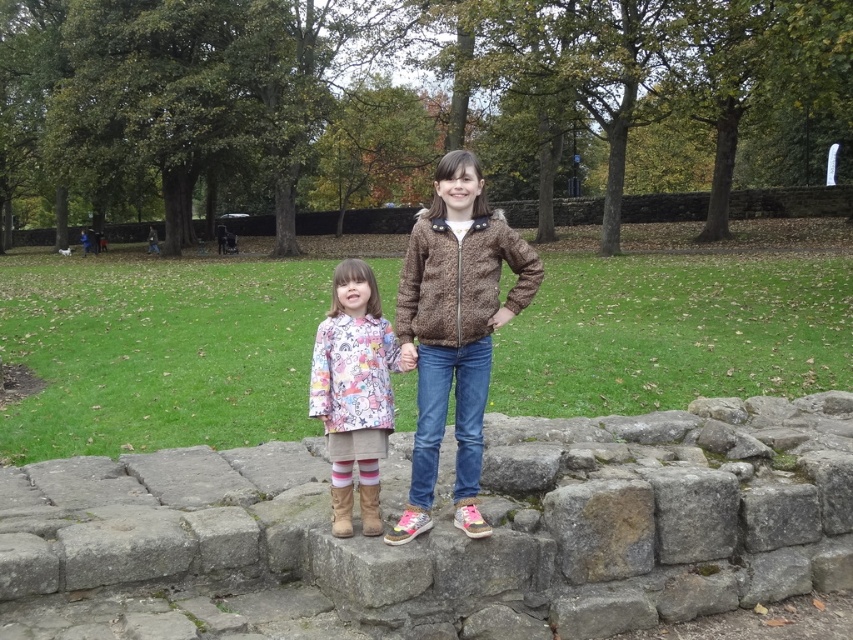
Question: Which object appears closest to the camera in this image?

Choices:
 (A) printed fabric coat at center
 (B) brown stone at center

Answer: (B)

Question: Which object is positioned farthest from the brown textured jacket at center?

Choices:
 (A) brown stone at center
 (B) printed fabric coat at center

Answer: (A)

Question: Which is nearer to the brown textured jacket at center?

Choices:
 (A) brown stone at center
 (B) printed fabric coat at center

Answer: (B)

Question: Is brown stone at center to the left of brown textured jacket at center from the viewer's perspective?

Choices:
 (A) yes
 (B) no

Answer: (A)

Question: In this image, where is brown stone at center located relative to brown textured jacket at center?

Choices:
 (A) above
 (B) below

Answer: (B)

Question: Where is brown stone at center located in relation to brown textured jacket at center in the image?

Choices:
 (A) left
 (B) right

Answer: (A)